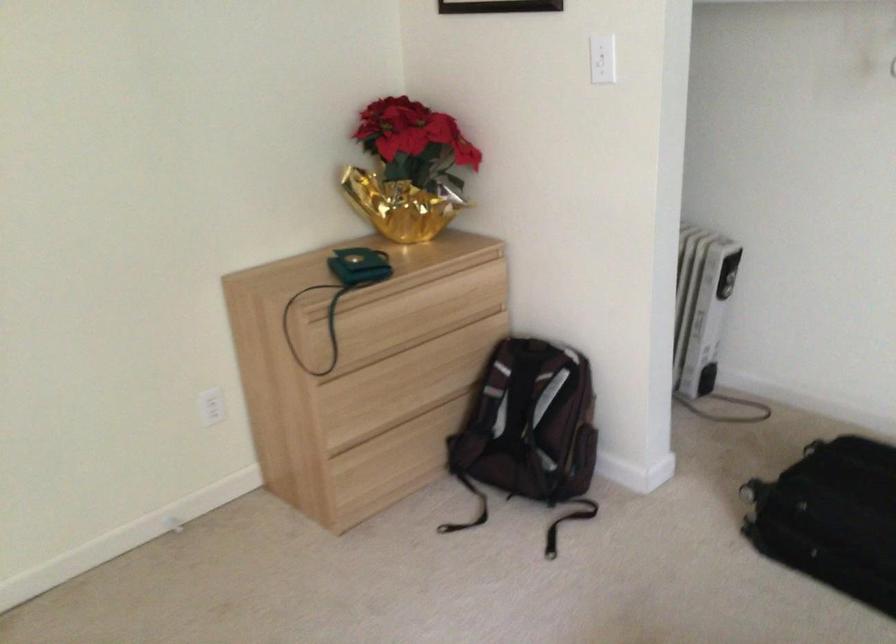
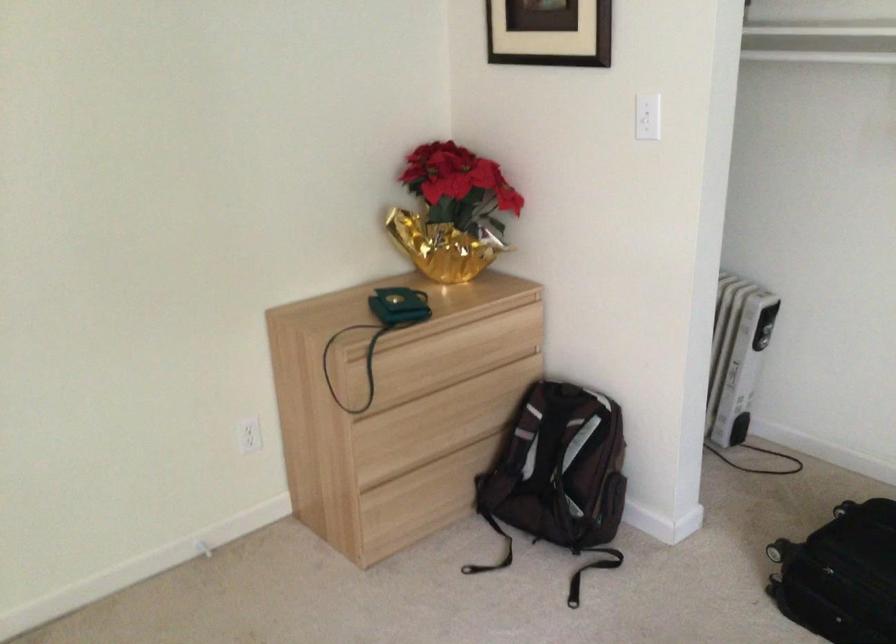
Locate, in the second image, the point that corresponds to (x=408, y=478) in the first image.

(435, 516)